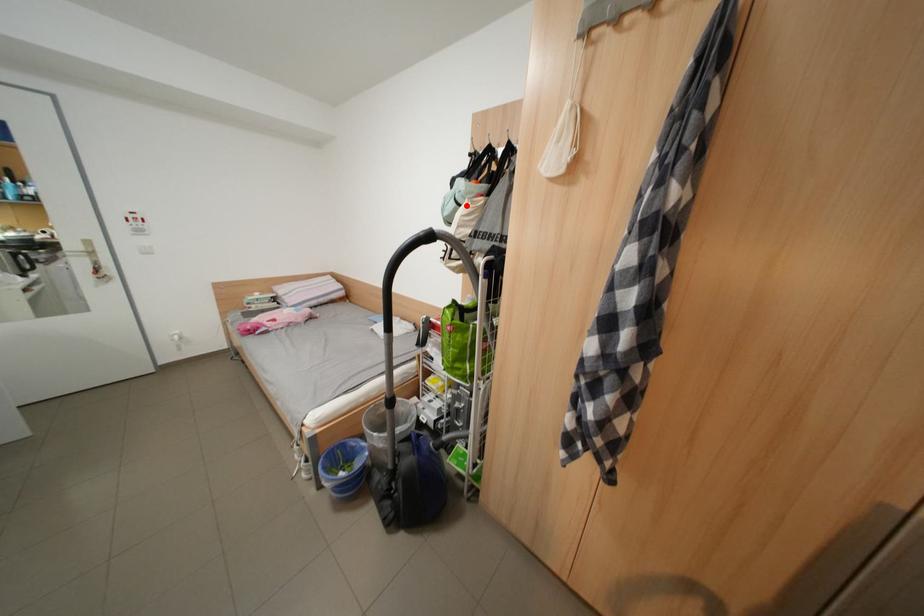
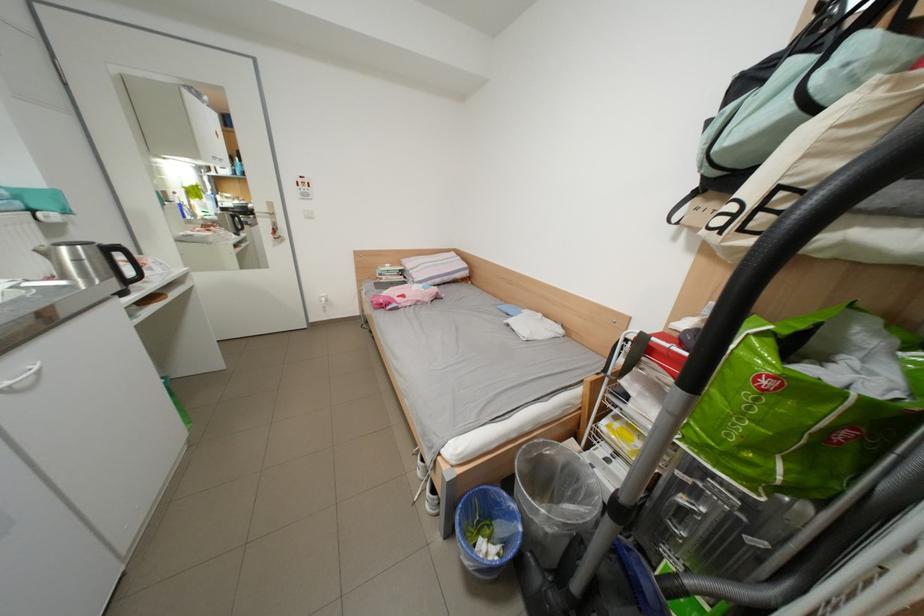
Question: I am providing you with two images of the same scene from different viewpoints. Given a red point in image1, look at the same physical point in image2. Is it:

Choices:
 (A) Closer to the viewpoint
 (B) Farther from the viewpoint

Answer: (B)